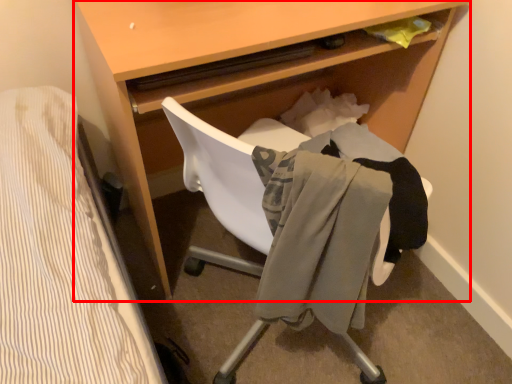
Question: From the image's perspective, what is the correct spatial positioning of desk (annotated by the red box) in reference to clothing?

Choices:
 (A) below
 (B) above

Answer: (B)